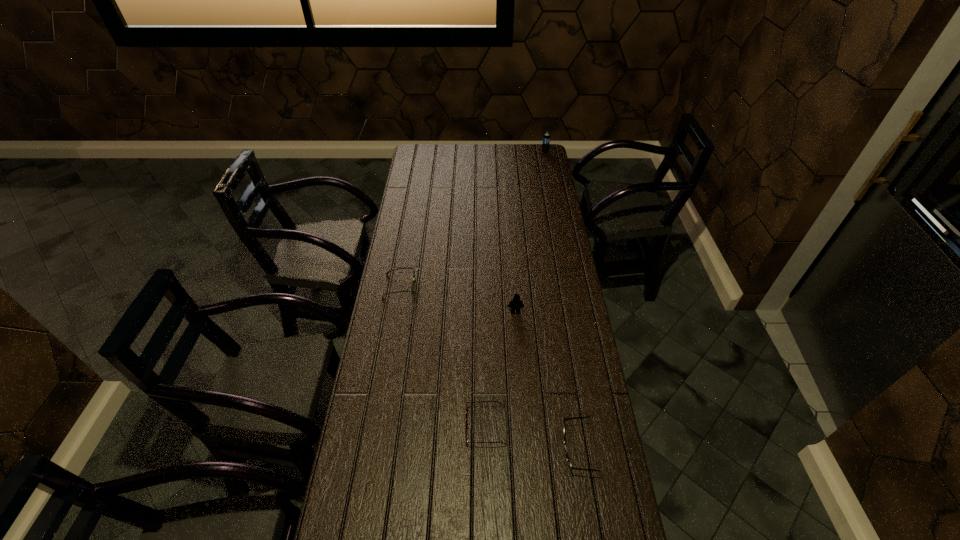
Locate an element on the screen. The width and height of the screenshot is (960, 540). object that is at the left edge is located at coordinates (412, 285).

The height and width of the screenshot is (540, 960). I want to click on soda bottle that is at the right edge, so click(x=546, y=138).

You are a GUI agent. You are given a task and a screenshot of the screen. Output one action in this format:
    pyautogui.click(x=<x>, y=<y>)
    Task: Click on the spectacles that is at the right edge
    This screenshot has height=540, width=960.
    Given the screenshot: What is the action you would take?
    pyautogui.click(x=567, y=456)

At what (x,y) coordinates should I click in order to perform the action: click on object situated at the far right corner. Please return your answer as a coordinate pair (x, y). Looking at the image, I should click on (546, 138).

At what (x,y) coordinates should I click in order to perform the action: click on free spot at the far edge of the desktop. Please return your answer as a coordinate pair (x, y). The height and width of the screenshot is (540, 960). Looking at the image, I should click on (520, 156).

This screenshot has width=960, height=540. Identify the location of vacant space at the left edge of the desktop. (419, 232).

This screenshot has height=540, width=960. I want to click on vacant space at the right edge of the desktop, so click(x=533, y=248).

Where is `free space at the far right corner`? This screenshot has height=540, width=960. free space at the far right corner is located at coordinates (546, 165).

This screenshot has height=540, width=960. I want to click on free spot between the shortest spectacles and the soda bottle, so click(516, 289).

Find the location of a particular element. unoccupied area between the second object from left to right and the third farthest object is located at coordinates (500, 369).